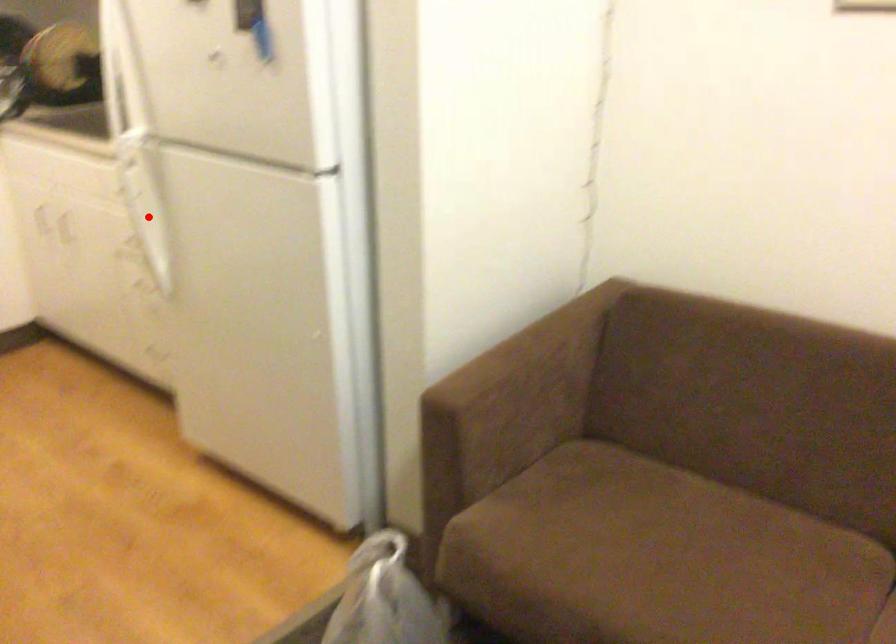
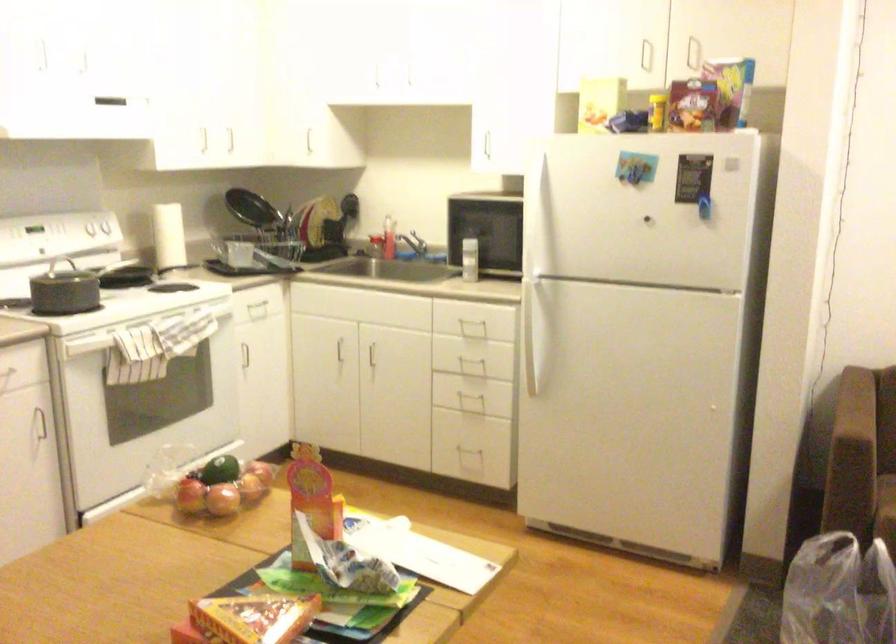
Locate, in the second image, the point that corresponds to the highlighted location in the first image.

(536, 328)